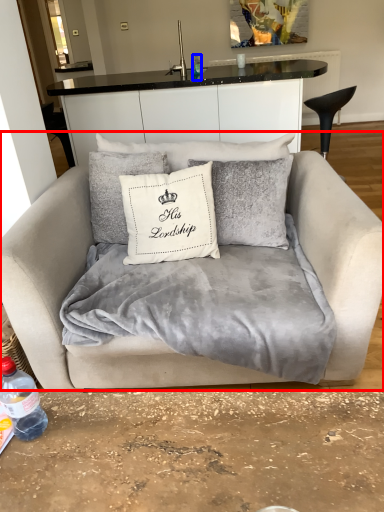
Question: Which object is further to the camera taking this photo, studio couch (highlighted by a red box) or bottle (highlighted by a blue box)?

Choices:
 (A) studio couch
 (B) bottle

Answer: (B)